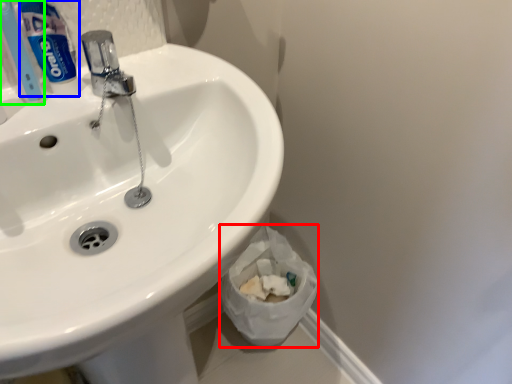
Question: Considering the real-world distances, which object is closest to toilet paper (highlighted by a red box)? toothpaste (highlighted by a blue box) or toothbrush (highlighted by a green box).

Choices:
 (A) toothpaste
 (B) toothbrush

Answer: (A)